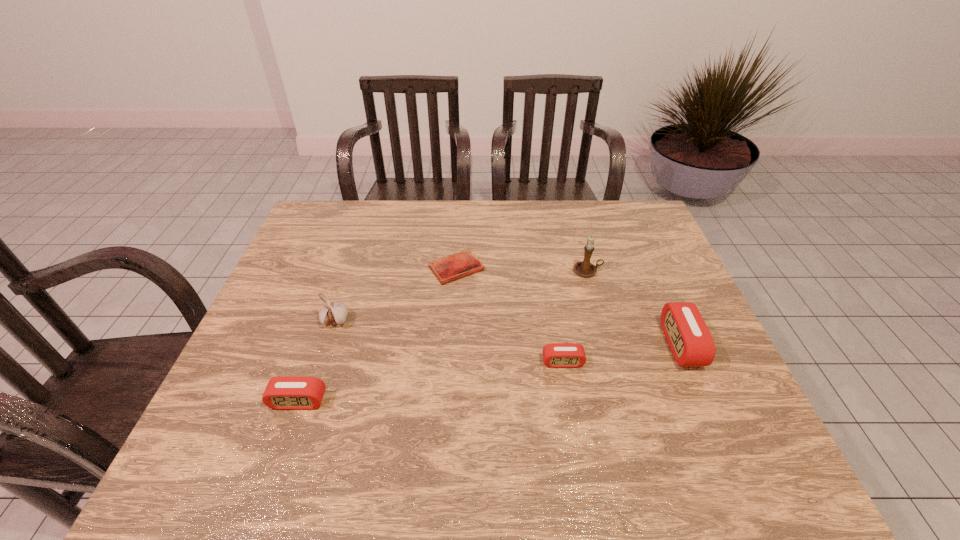
Where is `free space for an extra alarm_clock to achieve even spacing`? Image resolution: width=960 pixels, height=540 pixels. free space for an extra alarm_clock to achieve even spacing is located at coordinates (436, 381).